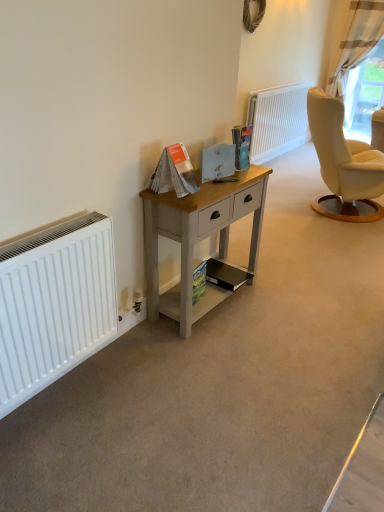
The image size is (384, 512). I want to click on free spot to the right of light gray wood desk at center, so click(x=284, y=307).